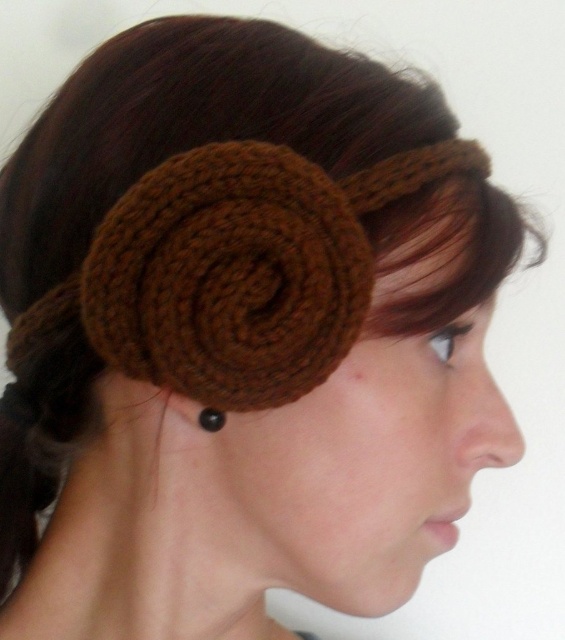
You are a stylist preparing to style a client with the brown knitted hair accessory at center and the black pearl earring at ear. Which accessory should you place first to ensure the other can be positioned properly?

The brown knitted hair accessory at center should be placed first because its width is larger than the black pearl earring at ear, so positioning it first allows proper placement of the smaller earring afterward.

You are a stylist preparing to take a photo of a client who has both a brown knitted hair accessory at center and a black pearl earring at ear. The client wants to ensure that the accessory is the focal point of the photo. Based on their sizes, which item should you adjust to emphasize the accessory?

The brown knitted hair accessory at center is larger than the black pearl earring at ear. To make the accessory the focal point, you can position the camera closer to the accessory or use lighting to highlight its size and texture compared to the smaller black pearl earring at ear.

In the scene shown: You are a photographer adjusting your camera settings. The subject has a brown knitted hair accessory at center. To ensure the accessory is in focus, what is the minimum distance you should set your camera focus to?

The minimum focus distance should be set to at least 15.73 inches to ensure the brown knitted hair accessory at center is in focus.